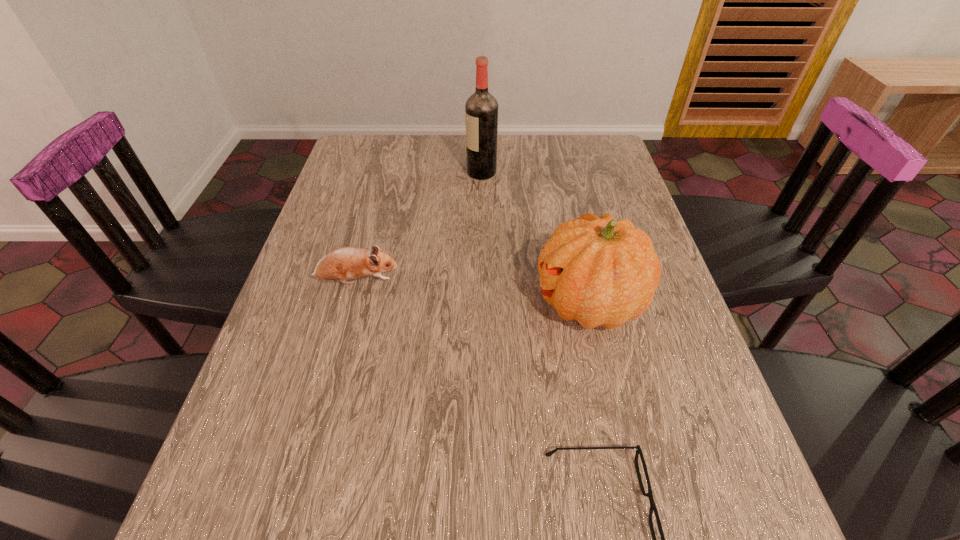
The width and height of the screenshot is (960, 540). Identify the location of the tallest object. (481, 109).

Locate an element on the screen. the farthest object is located at coordinates click(x=481, y=109).

Where is `pumpkin`? pumpkin is located at coordinates (598, 271).

Where is `the third tallest object`? This screenshot has width=960, height=540. the third tallest object is located at coordinates (344, 263).

Locate an element on the screen. hamster is located at coordinates (344, 263).

Where is `free region located on the front-facing side of the farthest object`? The width and height of the screenshot is (960, 540). free region located on the front-facing side of the farthest object is located at coordinates (368, 173).

You are a GUI agent. You are given a task and a screenshot of the screen. Output one action in this format:
    pyautogui.click(x=<x>, y=<y>)
    Task: Click on the free location located on the front-facing side of the farthest object
    The image size is (960, 540).
    Given the screenshot: What is the action you would take?
    pyautogui.click(x=351, y=173)

Where is `free space located 0.380m on the front-facing side of the farthest object`? free space located 0.380m on the front-facing side of the farthest object is located at coordinates (341, 173).

Where is `free space located 0.240m on the carved face of the second tallest object`? The width and height of the screenshot is (960, 540). free space located 0.240m on the carved face of the second tallest object is located at coordinates (426, 302).

I want to click on vacant space situated 0.180m on the carved face of the second tallest object, so click(453, 302).